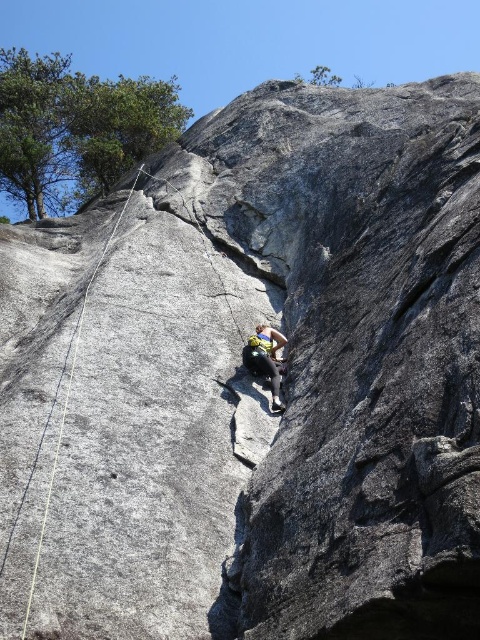
Who is shorter, yellow nylon rope at left or yellow climbing harness at center?

yellow climbing harness at center

Is point (72, 362) farther from viewer compared to point (276, 356)?

That is False.

Is point (36, 547) positioned in front of point (279, 339)?

Yes.

This screenshot has width=480, height=640. I want to click on yellow nylon rope at left, so click(68, 397).